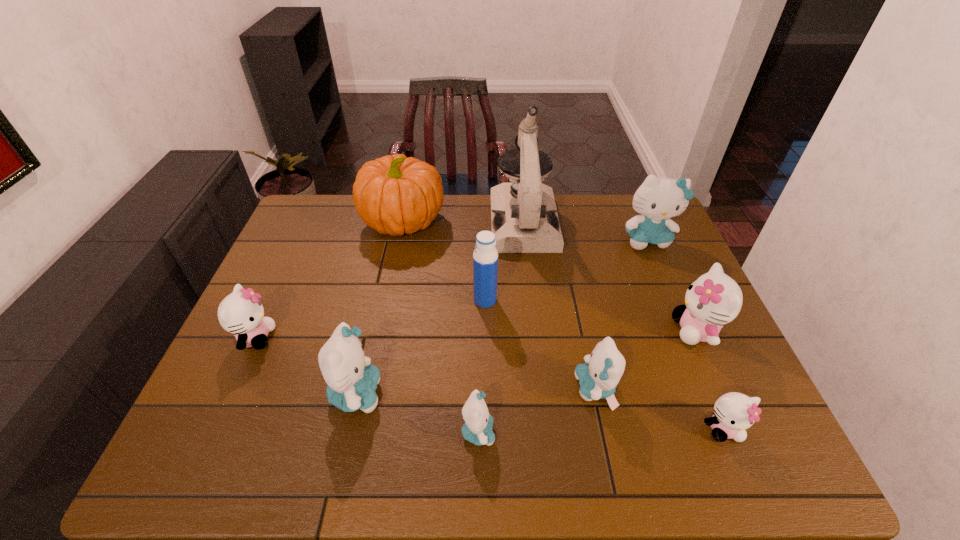
Locate an element on the screen. the leftmost object is located at coordinates (241, 313).

Identify the location of the leftmost white kitten. This screenshot has width=960, height=540. 241,313.

At what (x,y) coordinates should I click in order to perform the action: click on the third blue kitten from right to left. Please return your answer as a coordinate pair (x, y). This screenshot has width=960, height=540. Looking at the image, I should click on click(477, 429).

This screenshot has height=540, width=960. I want to click on the smallest blue kitten, so click(x=477, y=429).

This screenshot has width=960, height=540. Find the location of `the smallest white kitten`. the smallest white kitten is located at coordinates (734, 412).

Image resolution: width=960 pixels, height=540 pixels. Identify the location of free space located 0.260m at the eyepiece of the tallest object. (535, 315).

This screenshot has height=540, width=960. Find the location of `vacant region located 0.100m on the surface of the pumpkin`. vacant region located 0.100m on the surface of the pumpkin is located at coordinates (475, 221).

Image resolution: width=960 pixels, height=540 pixels. What are the coordinates of `blank space located 0.200m on the face of the farthest kitten` in the screenshot? It's located at (673, 300).

I want to click on vacant region located 0.330m on the front of the blue water bottle, so pos(487,418).

Where is `vacant space situated 0.270m on the face of the third smallest blue kitten`? The width and height of the screenshot is (960, 540). vacant space situated 0.270m on the face of the third smallest blue kitten is located at coordinates (497, 394).